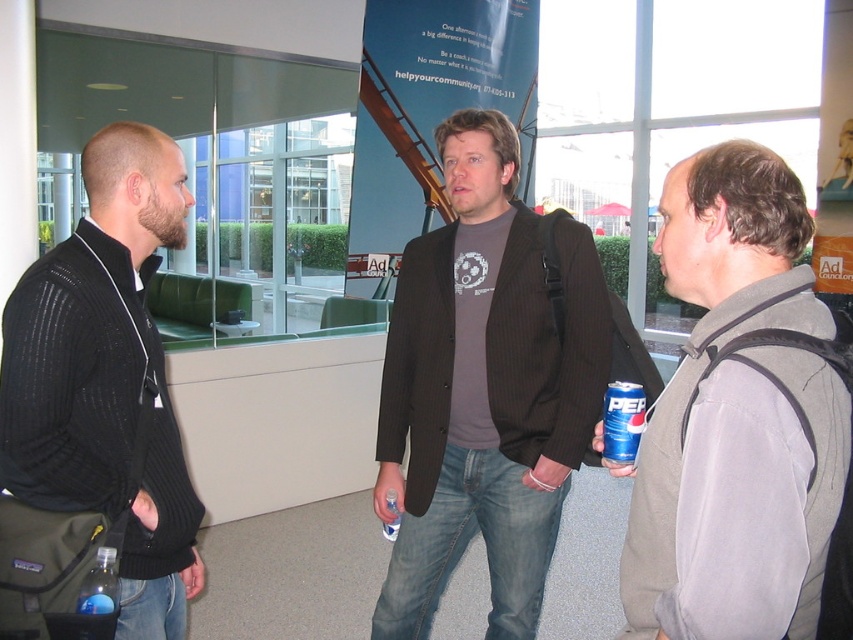
Question: Among these objects, which one is farthest from the camera?

Choices:
 (A) black ribbed sweater at left
 (B) translucent blue bottle at lower left

Answer: (B)

Question: Among these points, which one is nearest to the camera?

Choices:
 (A) (450, 381)
 (B) (631, 444)

Answer: (B)

Question: Which object appears closest to the camera in this image?

Choices:
 (A) translucent blue bottle at lower left
 (B) black ribbed sweater at left

Answer: (B)

Question: From the image, what is the correct spatial relationship of dark brown pinstripe blazer at center in relation to blue metallic can at center right?

Choices:
 (A) above
 (B) below

Answer: (A)

Question: Does blue metallic can at center right lie in front of translucent blue bottle at lower left?

Choices:
 (A) no
 (B) yes

Answer: (A)

Question: Can you confirm if gray fleece vest at center is positioned to the left of translucent blue bottle at lower left?

Choices:
 (A) no
 (B) yes

Answer: (A)